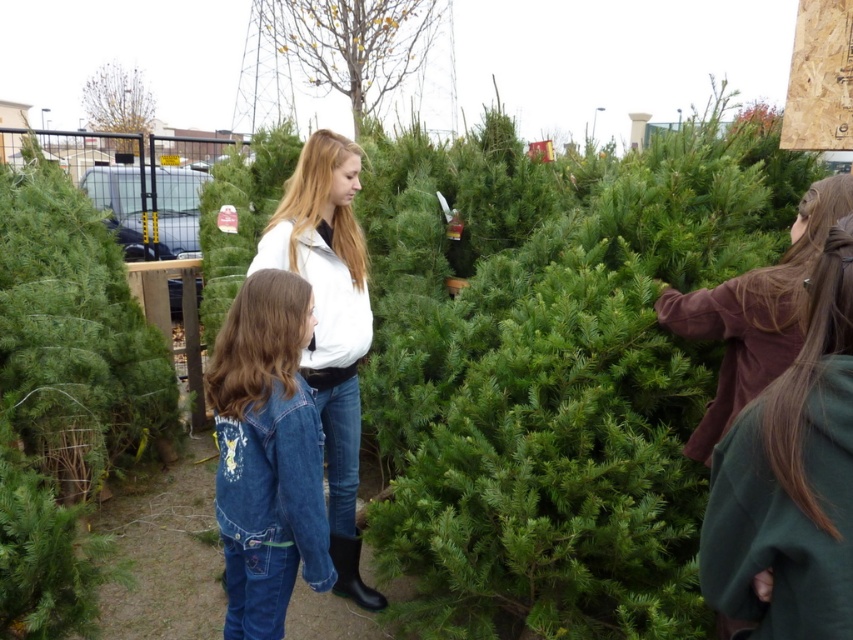
Question: Estimate the real-world distances between objects in this image. Which object is closer to the green matte christmas tree at left?

Choices:
 (A) green textured pine tree at center
 (B) white matte jacket at center

Answer: (B)

Question: Is smooth bark tree at upper center below brown fuzzy coat at right?

Choices:
 (A) yes
 (B) no

Answer: (B)

Question: Considering the relative positions of white matte jacket at center and smooth bark tree at upper center in the image provided, where is white matte jacket at center located with respect to smooth bark tree at upper center?

Choices:
 (A) above
 (B) below

Answer: (B)

Question: Which point is closer to the camera?

Choices:
 (A) (x=254, y=353)
 (B) (x=698, y=317)
 (C) (x=88, y=115)
 (D) (x=820, y=348)

Answer: (D)

Question: Does green matte christmas tree at left appear on the right side of white matte jacket at center?

Choices:
 (A) yes
 (B) no

Answer: (B)

Question: Among these objects, which one is farthest from the camera?

Choices:
 (A) smooth bark tree at upper center
 (B) white matte jacket at center
 (C) green matte christmas tree at left

Answer: (A)